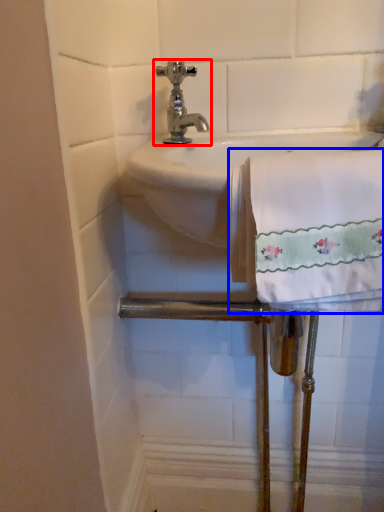
Question: Which of the following is the closest to the observer, tap (highlighted by a red box) or bath towel (highlighted by a blue box)?

Choices:
 (A) tap
 (B) bath towel

Answer: (B)